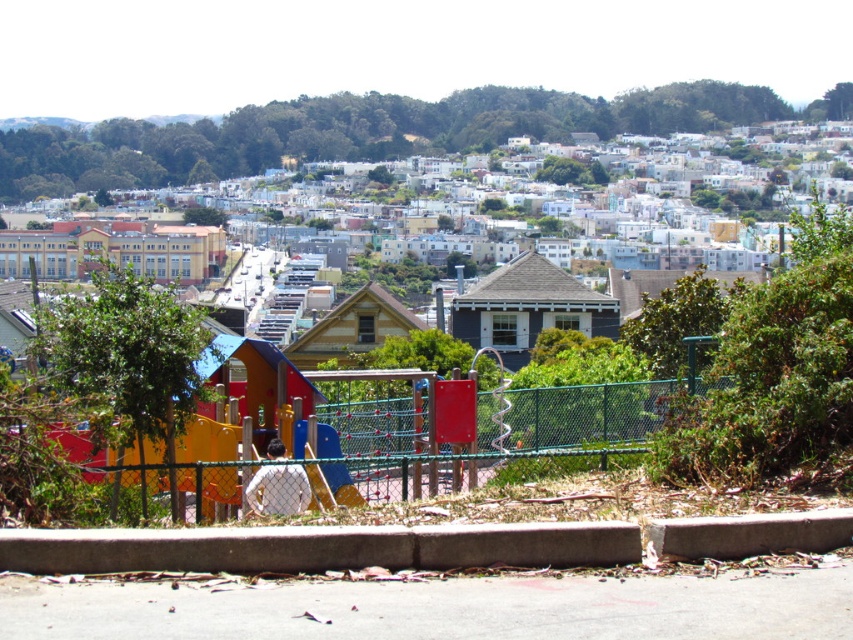
Is green grassy hillside at upper center below green chain-link fence at center?

No.

What do you see at coordinates (370, 131) in the screenshot?
I see `green grassy hillside at upper center` at bounding box center [370, 131].

Is point (676, 125) behind point (616, 400)?

Yes, point (676, 125) is farther from viewer.

The image size is (853, 640). I want to click on green grassy hillside at upper center, so click(x=370, y=131).